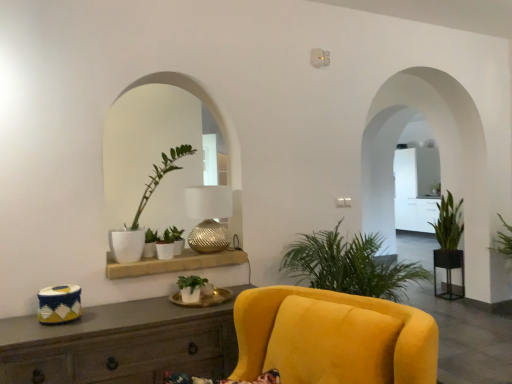
The height and width of the screenshot is (384, 512). In order to click on free space to the left of green matte plant at center, arranged as the sixth houseplant when viewed from the back in this screenshot , I will do `click(158, 303)`.